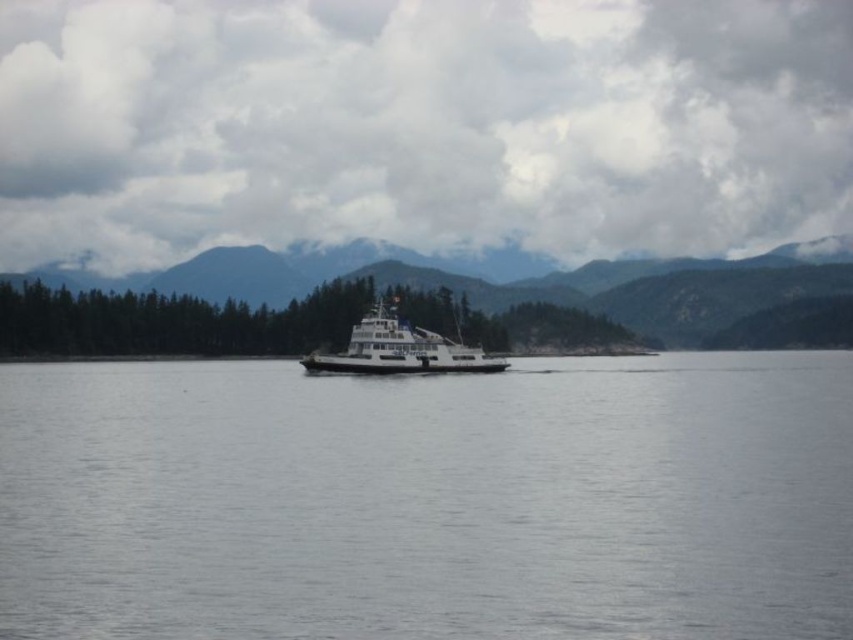
From the picture: You are a photographer trying to capture the ferry boat in the scene. To ensure the ferry boat is in focus while the mountains are slightly blurred, which object should you position closer to the camera lens? The ferry boat is not listed in the objects, but you must use the objects provided. Please choose between the clear water at center and the green forested mountain at center.

You should position the clear water at center closer to the camera lens because it is in front of the green forested mountain at center. This way, the ferry boat, which is at the same plane as the water, will be in focus, while the mountains farther back will appear blurred.

Looking at this image, you are a photographer standing on the ferry boat positioned centrally in the frame. You want to capture a photo of the green forested mountain at center. Based on its coordinates, can you estimate its location relative to the ferry boat?

The green forested mountain at center is located at coordinates point [444,305], which places it slightly to the left and above the center of the image frame. Since the ferry boat is positioned centrally, the mountain is just to the left and slightly higher up in the frame compared to the ferry boat.

You are standing on the ferry boat and want to determine the visibility of two points in the scene. Which point, point (154, 531) or point (415, 342), is closer to you?

Point (154, 531) is closer to the viewer than point (415, 342).